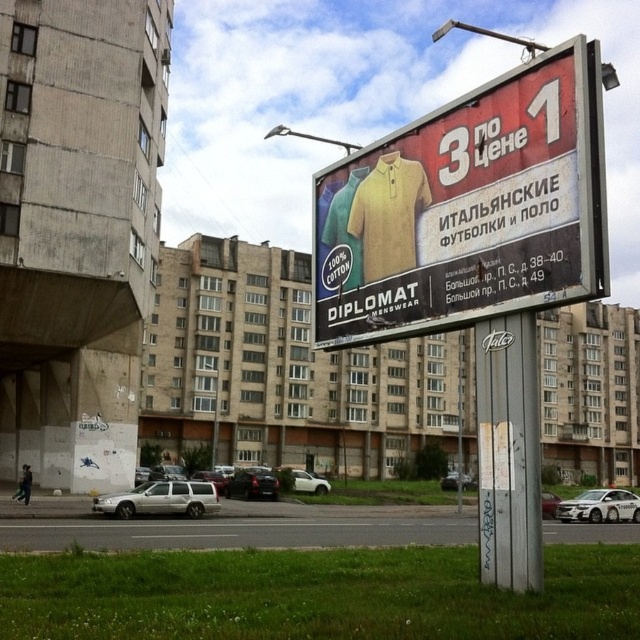
Question: Can you confirm if white matte car at lower center is smaller than metallic silver sedan at center?

Choices:
 (A) no
 (B) yes

Answer: (B)

Question: Is red matte signboard at upper right closer to camera compared to shiny black sedan at center?

Choices:
 (A) yes
 (B) no

Answer: (A)

Question: Which of the following is the closest to the observer?

Choices:
 (A) shiny black sedan at center
 (B) red matte signboard at upper right
 (C) metallic silver sedan at center
 (D) silver metallic sedan at center

Answer: (B)

Question: Which point is farther to the camera?

Choices:
 (A) click(294, 490)
 (B) click(627, 506)
 (C) click(552, 515)

Answer: (A)

Question: Which object is farther from the camera taking this photo?

Choices:
 (A) silver metallic van at center
 (B) white matte car at lower center
 (C) white glossy sedan at lower right

Answer: (A)

Question: Is white matte car at lower center bigger than metallic silver sedan at center?

Choices:
 (A) no
 (B) yes

Answer: (A)